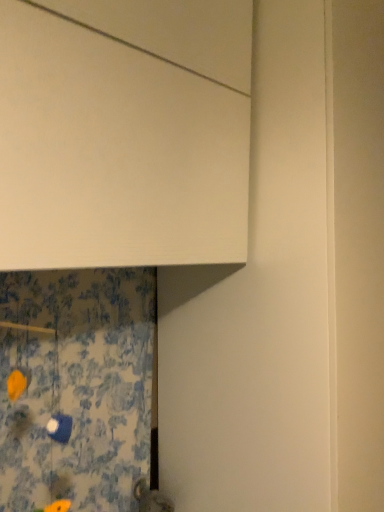
Question: From a real-world perspective, relative to white matte cabinet at upper center, is blue floral fabric at lower left vertically above or below?

Choices:
 (A) above
 (B) below

Answer: (B)

Question: Does point (114, 437) appear closer or farther from the camera than point (102, 178)?

Choices:
 (A) farther
 (B) closer

Answer: (A)

Question: From their relative heights in the image, would you say blue floral fabric at lower left is taller or shorter than white matte cabinet at upper center?

Choices:
 (A) short
 (B) tall

Answer: (A)

Question: Considering the positions of white matte cabinet at upper center and blue floral fabric at lower left in the image, is white matte cabinet at upper center taller or shorter than blue floral fabric at lower left?

Choices:
 (A) tall
 (B) short

Answer: (A)

Question: From a real-world perspective, is white matte cabinet at upper center above or below blue floral fabric at lower left?

Choices:
 (A) below
 (B) above

Answer: (B)

Question: From the image's perspective, is white matte cabinet at upper center positioned above or below blue floral fabric at lower left?

Choices:
 (A) below
 (B) above

Answer: (B)

Question: Is white matte cabinet at upper center wider or thinner than blue floral fabric at lower left?

Choices:
 (A) thin
 (B) wide

Answer: (B)